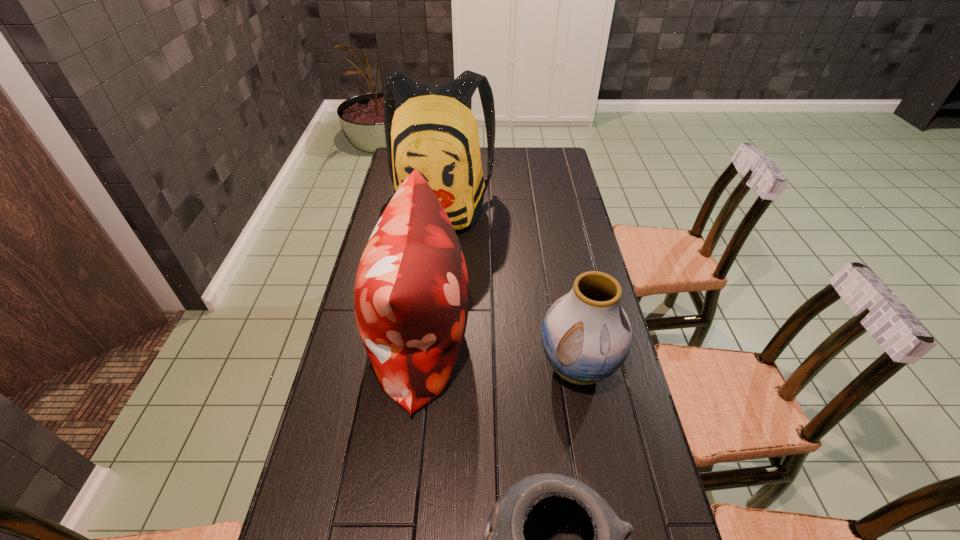
Where is `vacant region that satisfies the following two spatial constraints: 1. on the front-facing side of the vase; 2. on the right side of the second tallest object`? vacant region that satisfies the following two spatial constraints: 1. on the front-facing side of the vase; 2. on the right side of the second tallest object is located at coordinates (419, 367).

This screenshot has height=540, width=960. What are the coordinates of `vacant area that satisfies the following two spatial constraints: 1. on the front-facing side of the second shortest object; 2. on the right side of the farthest object` in the screenshot? It's located at (423, 367).